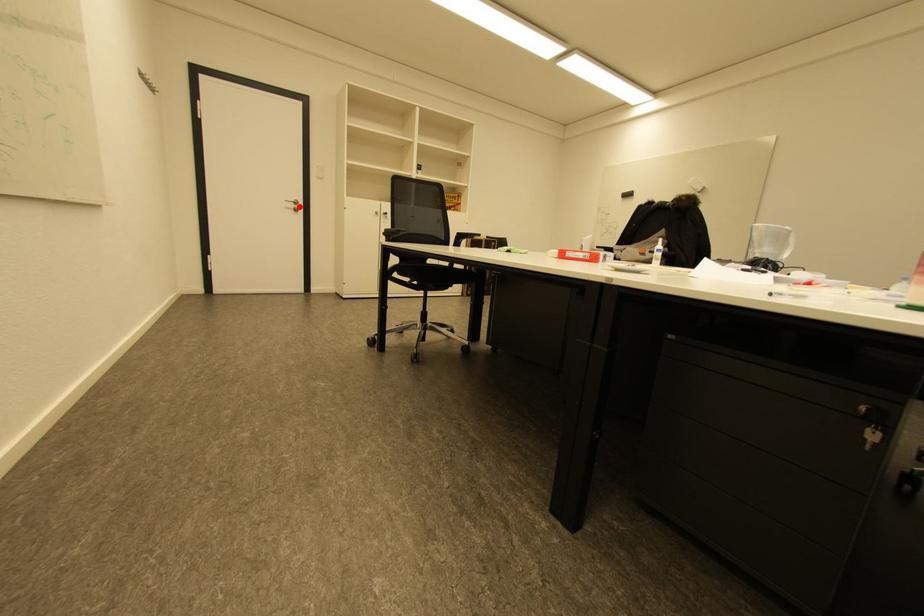
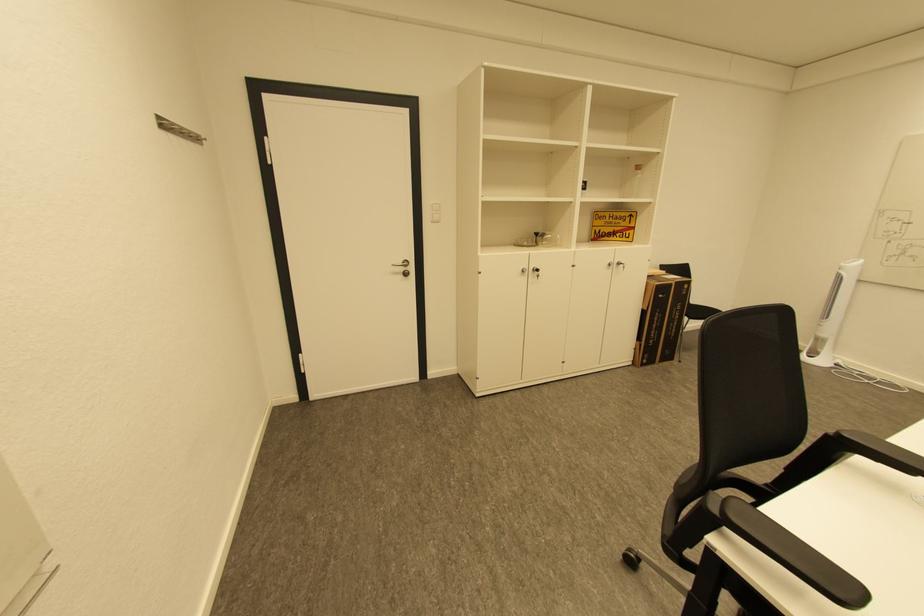
Find the pixel in the second image that matches the highlighted location in the first image.

(408, 270)